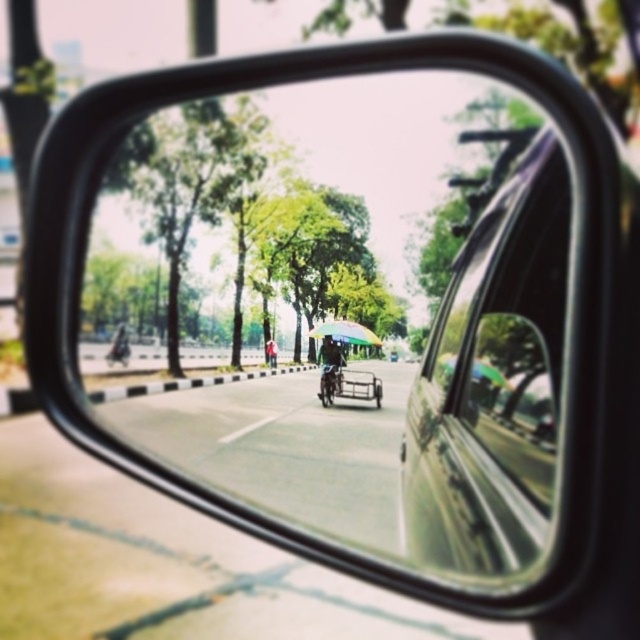
You are a driver checking your side mirror to change lanes. The clear glass mirror at center shows the road ahead. Based on its position at point 0.481, 0.541, can you determine if the mirror is positioned correctly for a proper lane change?

The clear glass mirror at center is positioned at coordinates (346, 307), which is centrally located, ensuring a proper view of the road ahead for a safe lane change.

You are a delivery driver who needs to pass through a narrow alley that is 1.5 meters wide. You observe the metallic silver bicycle at center and the green fabric umbrella at center in your side mirror. Can both items fit side by side in the alley without overlapping?

The metallic silver bicycle at center is wider than the green fabric umbrella at center. Since the alley is only 1.5 meters wide, it depends on the combined width of both items. However, since the bicycle is wider, if its width alone exceeds 1.5 meters, they cannot fit. If the bicycle is under 1.5 meters, they might fit together. But the exact widths aren